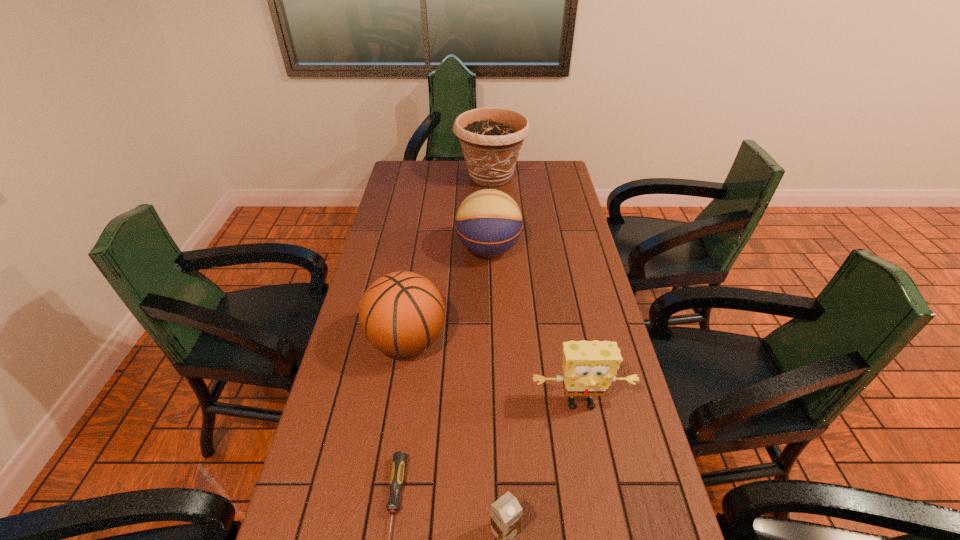
Locate an element on the screen. flowerpot is located at coordinates click(x=491, y=138).

Locate an element on the screen. The image size is (960, 540). the second farthest object is located at coordinates (488, 222).

The width and height of the screenshot is (960, 540). What are the coordinates of `the right basketball` in the screenshot? It's located at (488, 222).

Locate an element on the screen. This screenshot has width=960, height=540. the left basketball is located at coordinates (402, 313).

This screenshot has width=960, height=540. Find the location of `the fourth nearest object`. the fourth nearest object is located at coordinates (402, 313).

You are a GUI agent. You are given a task and a screenshot of the screen. Output one action in this format:
    pyautogui.click(x=<x>, y=<y>)
    Task: Click on the sponge
    
    Given the screenshot: What is the action you would take?
    pyautogui.click(x=589, y=367)

Locate an element on the screen. free space located on the front of the farthest object is located at coordinates (493, 242).

Identify the location of free space located 0.130m on the patterned surface of the right basketball. (420, 249).

Identify the location of vacant space located on the patterned surface of the right basketball. The width and height of the screenshot is (960, 540). (410, 249).

Where is `vacant area situated 0.300m on the patterned surface of the right basketball`? vacant area situated 0.300m on the patterned surface of the right basketball is located at coordinates tap(373, 249).